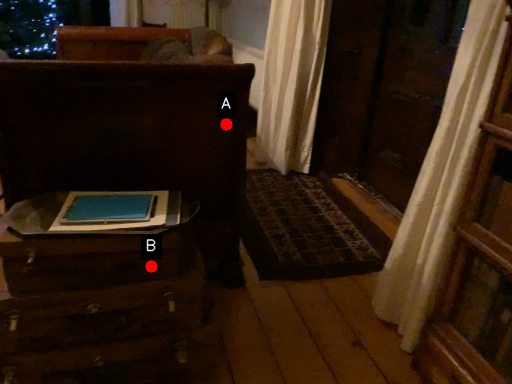
Question: Two points are circled on the image, labeled by A and B beside each circle. Which point appears farthest from the camera in this image?

Choices:
 (A) A is further
 (B) B is further

Answer: (A)